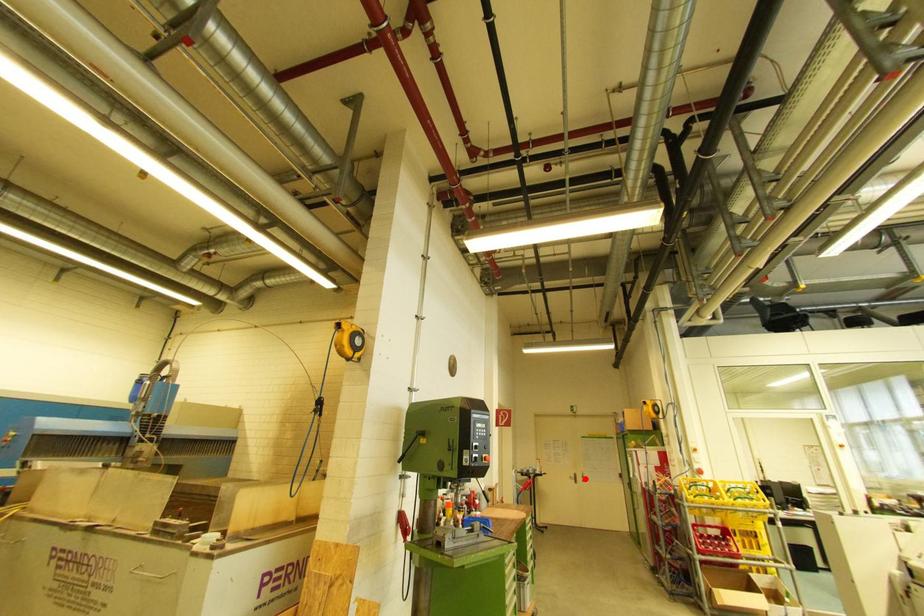
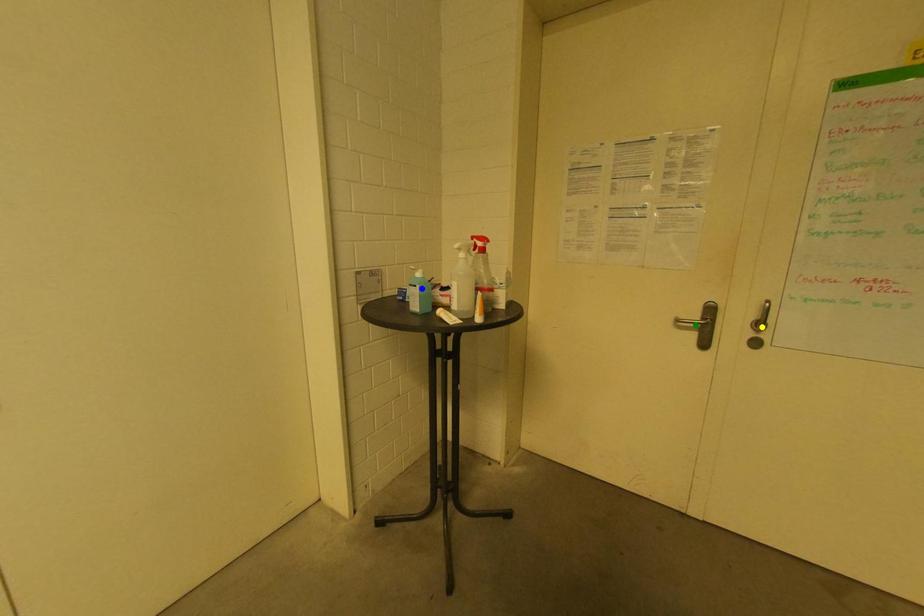
Question: I am providing you with two images of the same scene from different viewpoints. A red point is marked on the first image. You are given multiple points on the second image. Which point in image 2 is actually the same real-world point as the red point in image 1?

Choices:
 (A) green point
 (B) blue point
 (C) yellow point

Answer: (C)